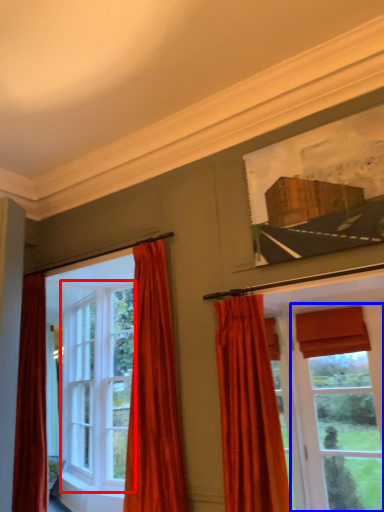
Question: Which object is further to the camera taking this photo, window (highlighted by a red box) or window (highlighted by a blue box)?

Choices:
 (A) window
 (B) window

Answer: (A)